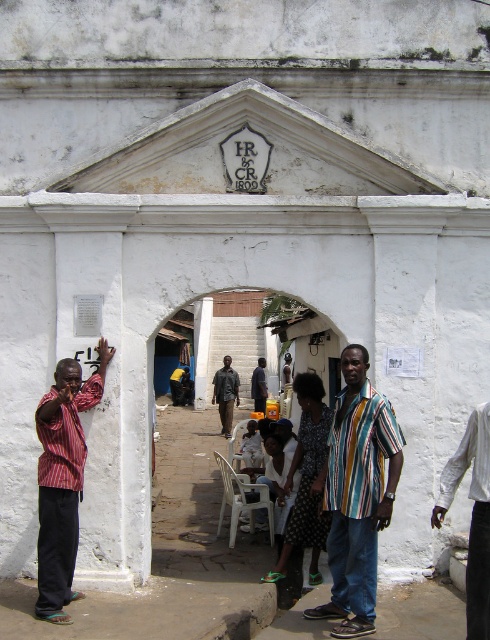
Based on the photo, you are an observer standing outside the building and looking into the courtyard. You notice two people wearing a striped fabric shirt at left and a dark brown leather jacket at center. Which clothing item is taller?

The striped fabric shirt at left has a greater height compared to the dark brown leather jacket at center.

You are standing outside the entrance of the building and notice two people in the courtyard. One is wearing a striped fabric shirt at left and the other a dark blue shirt at center. From your vantage point, which person is positioned more to the left?

The striped fabric shirt at left is positioned more to the left compared to the dark blue shirt at center.